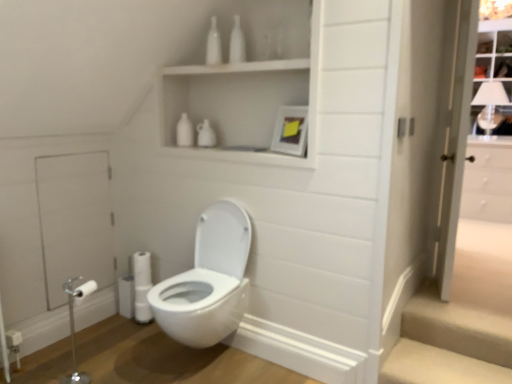
Question: Considering the positions of white glossy toilet at center and white glossy bottle at upper center, marked as the second toiletry in a right-to-left arrangement, in the image, is white glossy toilet at center taller or shorter than white glossy bottle at upper center, marked as the second toiletry in a right-to-left arrangement,?

Choices:
 (A) short
 (B) tall

Answer: (B)

Question: From the image's perspective, is white glossy toilet at center above or below white glossy bottle at upper center, placed as the 1th toiletry when sorted from left to right?

Choices:
 (A) above
 (B) below

Answer: (B)

Question: Which object is positioned closest to the white glossy door at right?

Choices:
 (A) beige carpeted stairs at lower right
 (B) white glossy cabinet at upper center
 (C) white glass window at upper right
 (D) silver metallic toilet paper holder at lower left
 (E) white glossy toilet at center

Answer: (A)

Question: Considering the real-world distances, which object is closest to the silver metallic toilet paper holder at lower left?

Choices:
 (A) white glossy door at right
 (B) white glass window at upper right
 (C) clear glass screen door at left, the 1th screen door from the left
 (D) beige carpeted stairs at lower right
 (E) white glossy cabinet at upper center

Answer: (C)